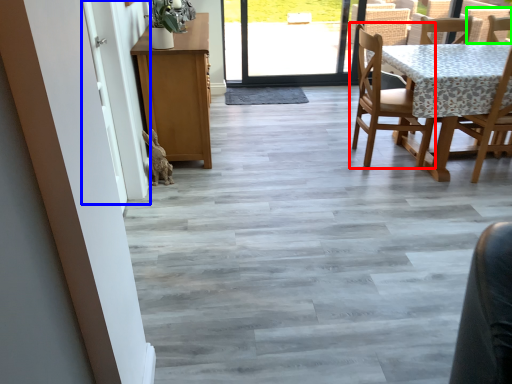
Question: Considering the real-world distances, which object is farthest from chair (highlighted by a red box)? screen door (highlighted by a blue box) or armchair (highlighted by a green box)?

Choices:
 (A) screen door
 (B) armchair

Answer: (A)